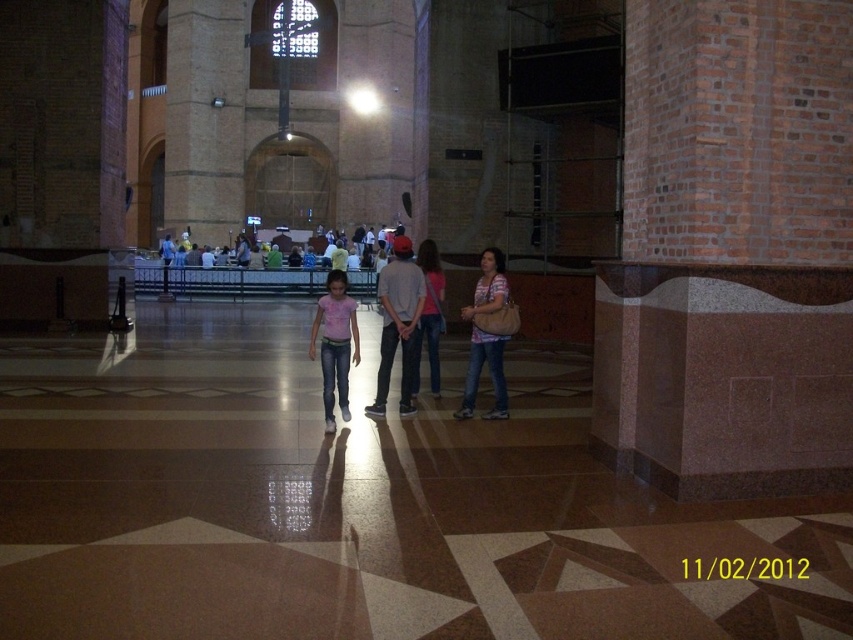
You are a photographer standing in the historic building and notice the matte brown purse at center and the pink denim jeans at center. Which object is positioned lower in the image?

The matte brown purse at center is positioned lower than the pink denim jeans at center in the image.

You are standing at the point labeled point (390, 352) and want to walk towards the entrance of the cathedral. Which direction should you move relative to the point labeled point (498, 401)?

Since point (390, 352) is behind point (498, 401), you should move forward towards the direction of point (498, 401) to reach the entrance.